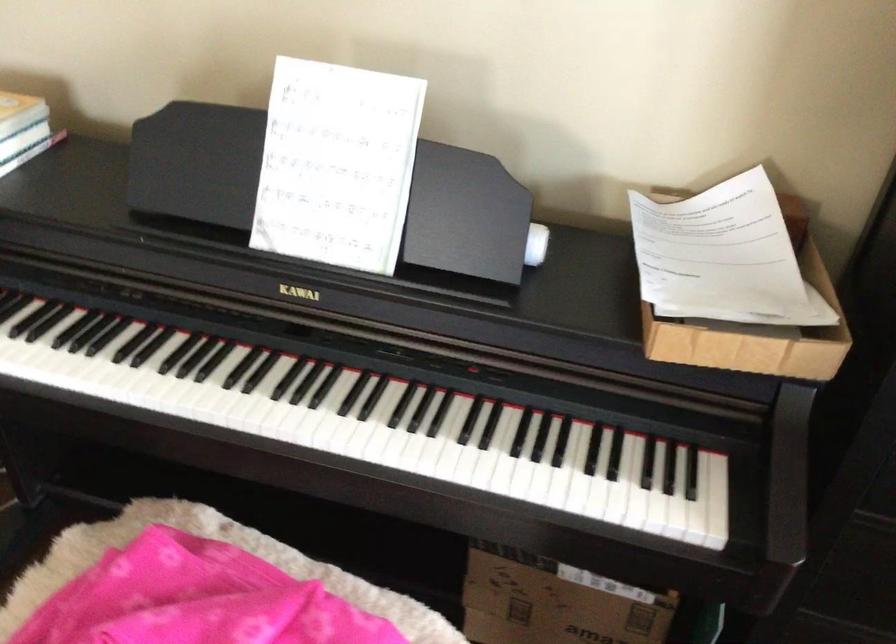
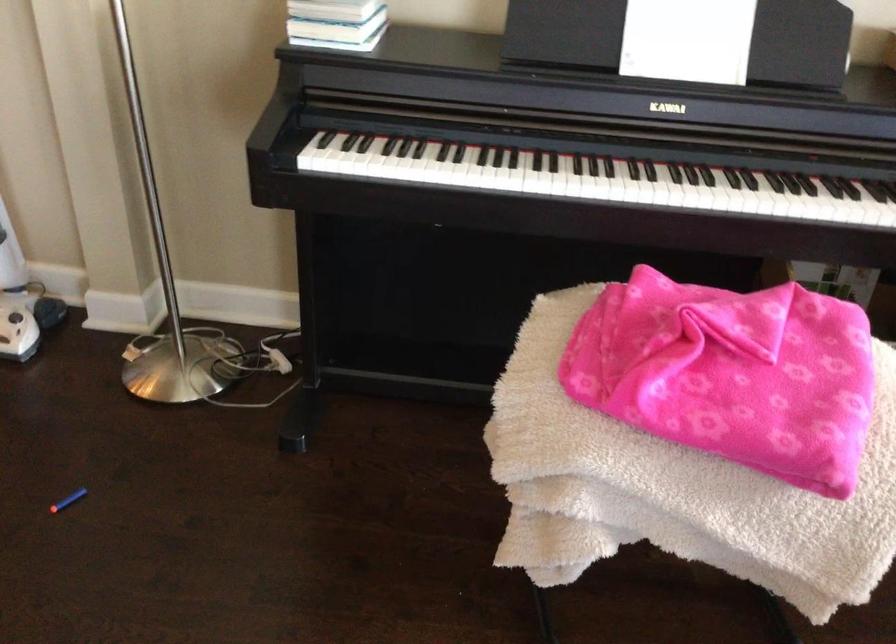
Question: The camera is either moving clockwise (left) or counter-clockwise (right) around the object. The first image is from the beginning of the video and the second image is from the end. Is the camera moving left or right when shooting the video?

Choices:
 (A) Left
 (B) Right

Answer: (A)